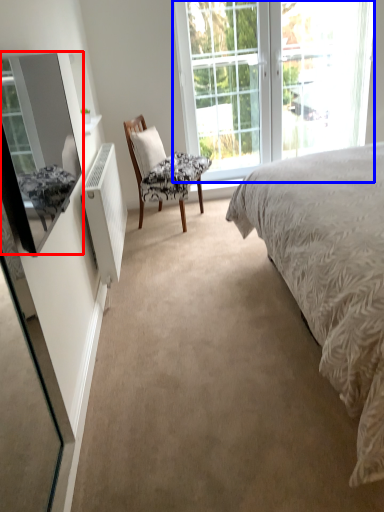
Question: Which point is further to the camera, mirror (highlighted by a red box) or window (highlighted by a blue box)?

Choices:
 (A) mirror
 (B) window

Answer: (B)